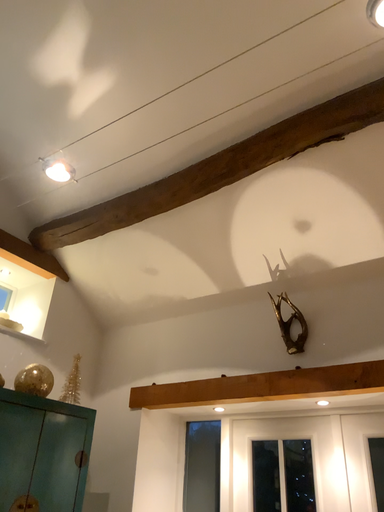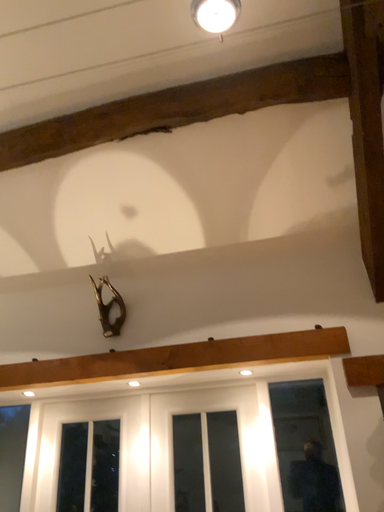
Question: How did the camera likely rotate when shooting the video?

Choices:
 (A) rotated left
 (B) rotated right

Answer: (B)